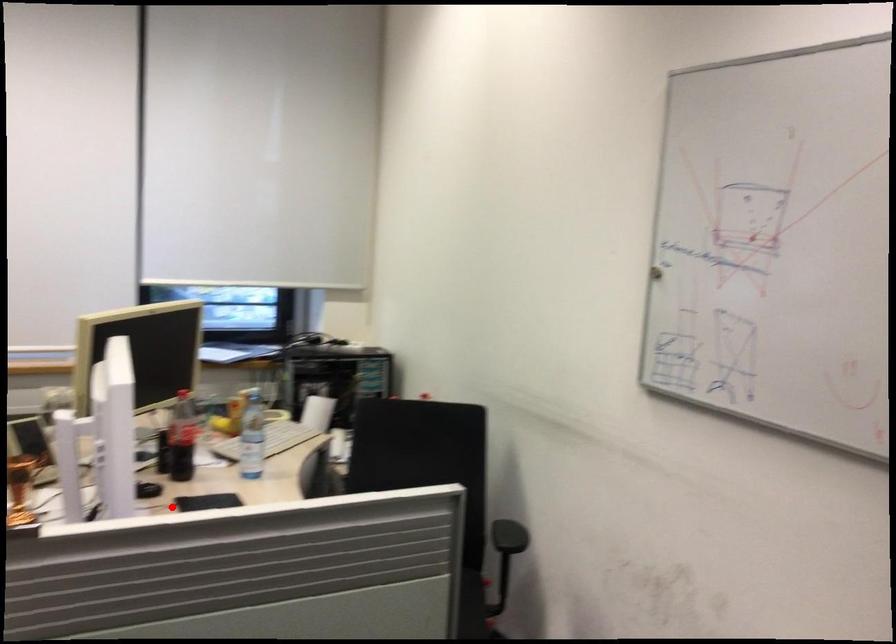
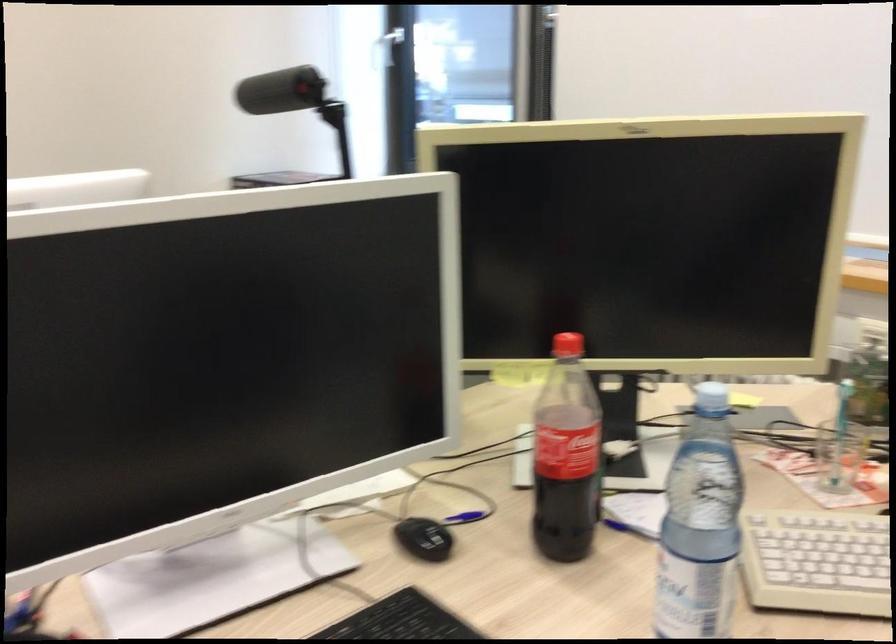
Question: I am providing you with two images of the same scene from different viewpoints. A red point is marked on the first image. Can you still see the location of the red point in image 2?

Choices:
 (A) Yes
 (B) No

Answer: (A)